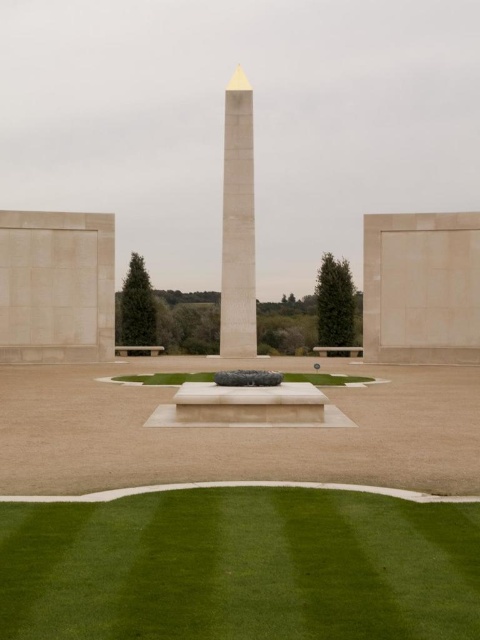
Does beige stone wall at right appear on the left side of white polished stone obelisk at center?

In fact, beige stone wall at right is to the right of white polished stone obelisk at center.

Is point (468, 278) closer to camera compared to point (235, 294)?

Yes, point (468, 278) is in front of point (235, 294).

The image size is (480, 640). What are the coordinates of `beige stone wall at right` in the screenshot? It's located at (421, 288).

This screenshot has height=640, width=480. I want to click on beige stone wall at right, so click(421, 288).

Who is higher up, beige stone wall at right or green grass at center?

beige stone wall at right is above.

Does beige stone wall at right appear under green grass at center?

No, beige stone wall at right is not below green grass at center.

This screenshot has height=640, width=480. What are the coordinates of `beige stone wall at right` in the screenshot? It's located at (421, 288).

Identify the location of beige stone wall at right. (421, 288).

Is green smooth lawn at center bigger than beige stone wall at left?

No, green smooth lawn at center is not bigger than beige stone wall at left.

Is point (478, 513) less distant than point (12, 288)?

Yes.

Identify the location of green smooth lawn at center. (240, 566).